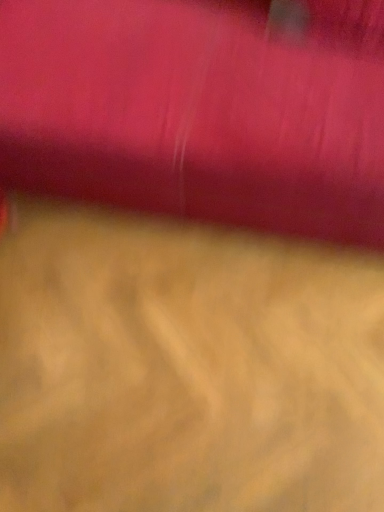
Question: Can you confirm if matte pink curtain at upper center is smaller than wooden floor at center?

Choices:
 (A) no
 (B) yes

Answer: (A)

Question: Does matte pink curtain at upper center appear on the left side of wooden floor at center?

Choices:
 (A) no
 (B) yes

Answer: (A)

Question: From a real-world perspective, is matte pink curtain at upper center on wooden floor at center?

Choices:
 (A) yes
 (B) no

Answer: (A)

Question: Can you confirm if matte pink curtain at upper center is positioned to the right of wooden floor at center?

Choices:
 (A) no
 (B) yes

Answer: (B)

Question: Can you confirm if matte pink curtain at upper center is taller than wooden floor at center?

Choices:
 (A) yes
 (B) no

Answer: (A)

Question: From the image's perspective, is matte pink curtain at upper center below wooden floor at center?

Choices:
 (A) no
 (B) yes

Answer: (A)

Question: From a real-world perspective, is wooden floor at center located higher than matte pink curtain at upper center?

Choices:
 (A) no
 (B) yes

Answer: (A)

Question: Does wooden floor at center turn towards matte pink curtain at upper center?

Choices:
 (A) no
 (B) yes

Answer: (A)

Question: Is wooden floor at center not inside matte pink curtain at upper center?

Choices:
 (A) no
 (B) yes

Answer: (B)

Question: Are wooden floor at center and matte pink curtain at upper center beside each other?

Choices:
 (A) yes
 (B) no

Answer: (B)

Question: Considering the relative sizes of wooden floor at center and matte pink curtain at upper center in the image provided, is wooden floor at center smaller than matte pink curtain at upper center?

Choices:
 (A) yes
 (B) no

Answer: (A)

Question: From the image's perspective, would you say wooden floor at center is positioned over matte pink curtain at upper center?

Choices:
 (A) yes
 (B) no

Answer: (B)

Question: From the image's perspective, is wooden floor at center above or below matte pink curtain at upper center?

Choices:
 (A) above
 (B) below

Answer: (B)